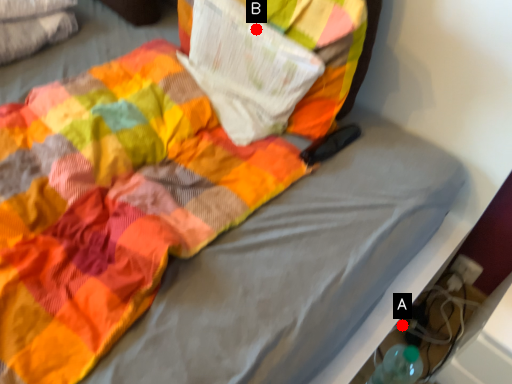
Question: Two points are circled on the image, labeled by A and B beside each circle. Which point is closer to the camera?

Choices:
 (A) A is closer
 (B) B is closer

Answer: (B)